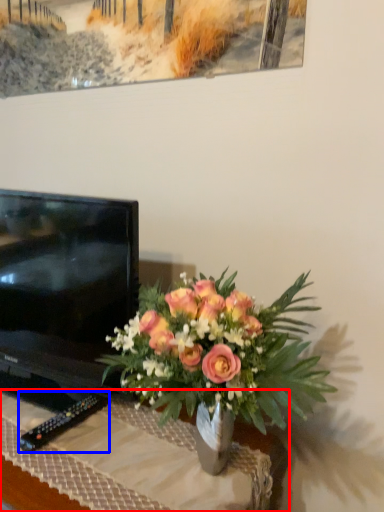
Question: Which of the following is the closest to the observer, desk (highlighted by a red box) or remote (highlighted by a blue box)?

Choices:
 (A) desk
 (B) remote

Answer: (A)